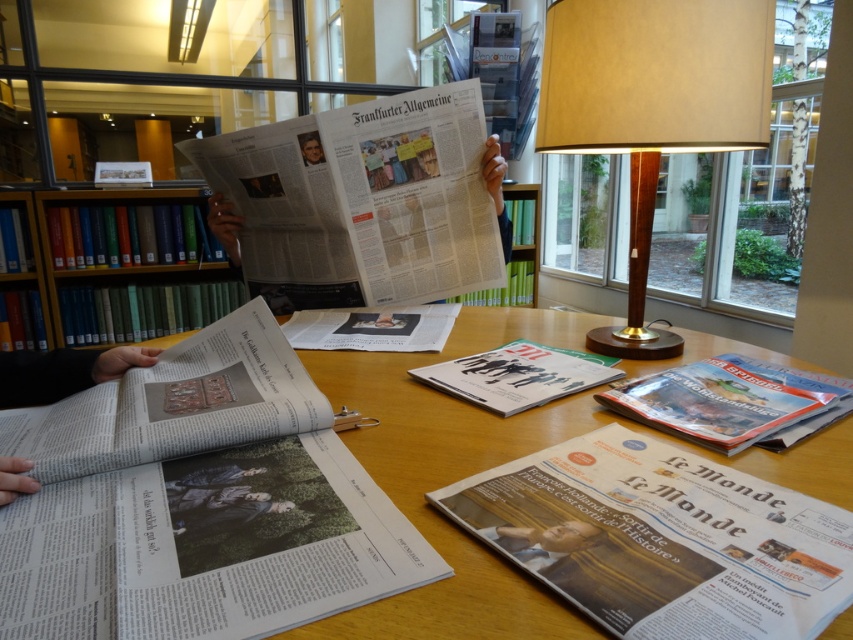
Question: Which object is farther from the camera taking this photo?

Choices:
 (A) smooth skin face at upper center
 (B) white paper at center
 (C) green matte bookshelf at upper left

Answer: (C)

Question: Which object appears closest to the camera in this image?

Choices:
 (A) green matte bookshelf at upper left
 (B) white paper at center
 (C) white paper newspaper at center
 (D) matte black magazine at center

Answer: (B)

Question: Does wooden table lamp at upper right have a larger size compared to smooth skin face at upper center?

Choices:
 (A) no
 (B) yes

Answer: (B)

Question: Can you confirm if wooden table lamp at upper right is positioned to the right of green matte bookshelf at upper left?

Choices:
 (A) no
 (B) yes

Answer: (B)

Question: Which object appears closest to the camera in this image?

Choices:
 (A) white paper at center
 (B) white paper newspaper at center
 (C) wooden table lamp at upper right
 (D) smooth skin face at upper center

Answer: (A)

Question: Observing the image, what is the correct spatial positioning of green matte bookshelf at upper left in reference to matte black magazine at center?

Choices:
 (A) left
 (B) right

Answer: (A)